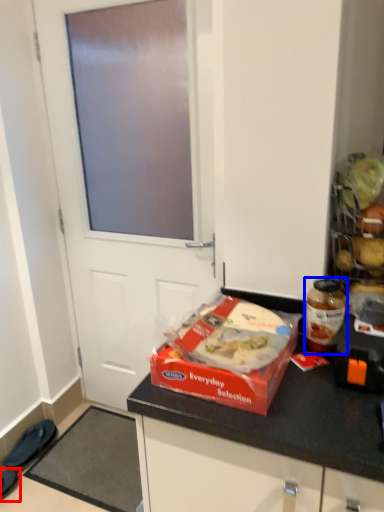
Question: Which object is closer to the camera taking this photo, footwear (highlighted by a red box) or bottle (highlighted by a blue box)?

Choices:
 (A) footwear
 (B) bottle

Answer: (B)